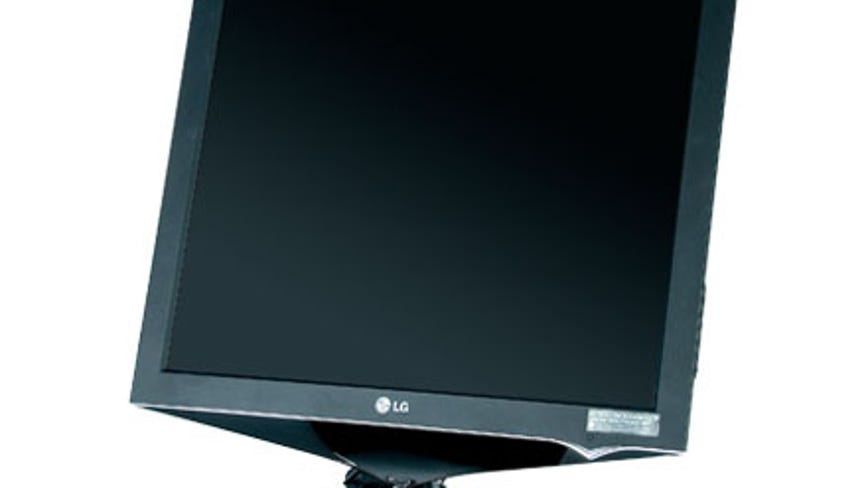
Locate an element on the screen. This screenshot has width=868, height=488. frame is located at coordinates (158, 314).